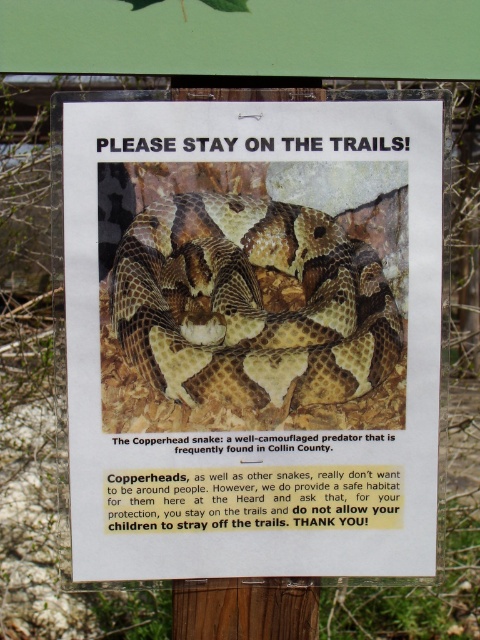
Question: Is camouflage-patterned snake at center above camouflage scales snake at center?

Choices:
 (A) yes
 (B) no

Answer: (B)

Question: Among these objects, which one is nearest to the camera?

Choices:
 (A) camouflage-patterned snake at center
 (B) camouflage scales snake at center

Answer: (A)

Question: Is camouflage-patterned snake at center thinner than camouflage scales snake at center?

Choices:
 (A) yes
 (B) no

Answer: (B)

Question: Among these objects, which one is nearest to the camera?

Choices:
 (A) camouflage scales snake at center
 (B) camouflage-patterned snake at center

Answer: (B)

Question: Can you confirm if camouflage-patterned snake at center is positioned below camouflage scales snake at center?

Choices:
 (A) yes
 (B) no

Answer: (A)